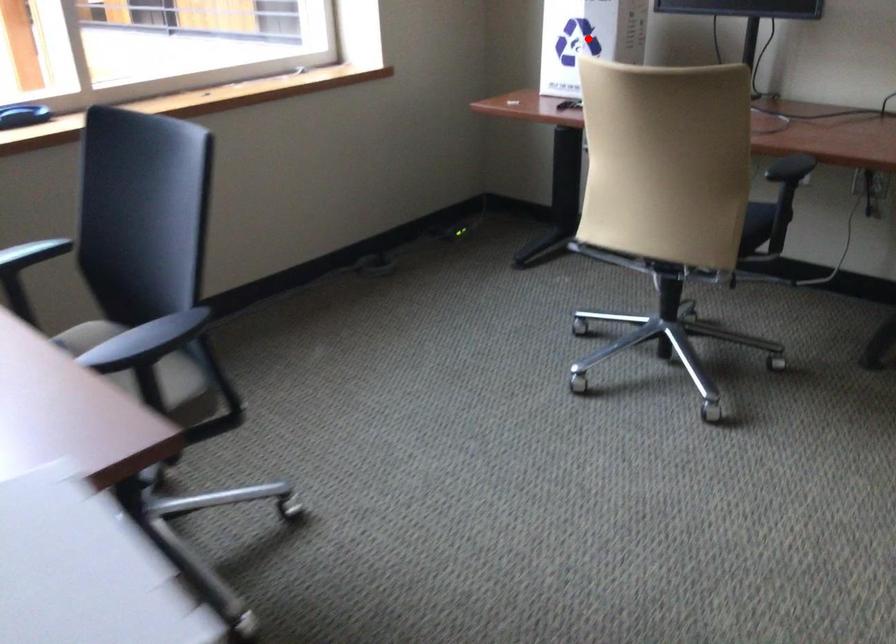
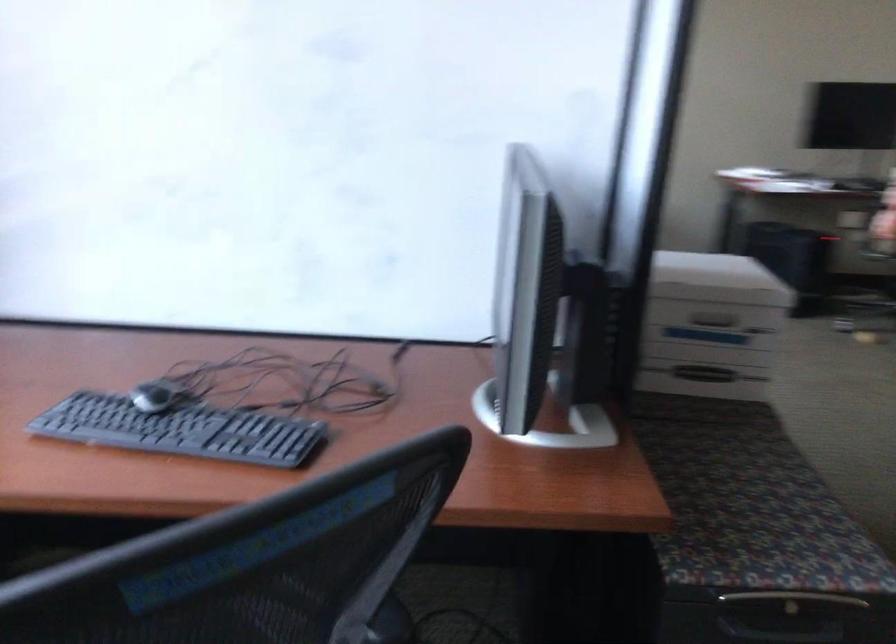
Question: I am providing you with two images of the same scene from different viewpoints. A red point is marked on the first image. At the location where the point appears in image 1, is it still visible in image 2?

Choices:
 (A) Yes
 (B) No

Answer: (B)